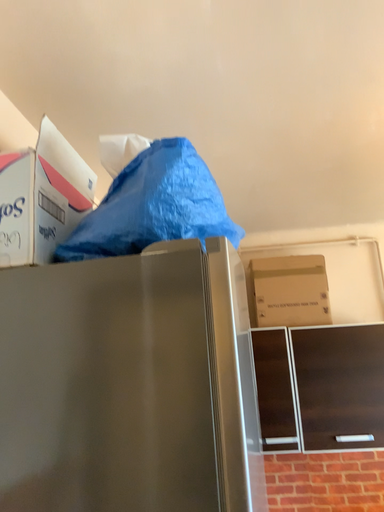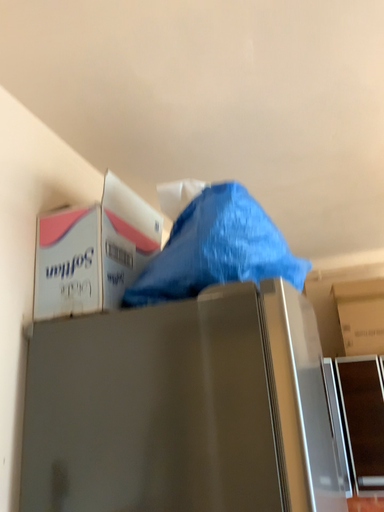
Question: Which way did the camera rotate in the video?

Choices:
 (A) rotated right
 (B) rotated left

Answer: (B)